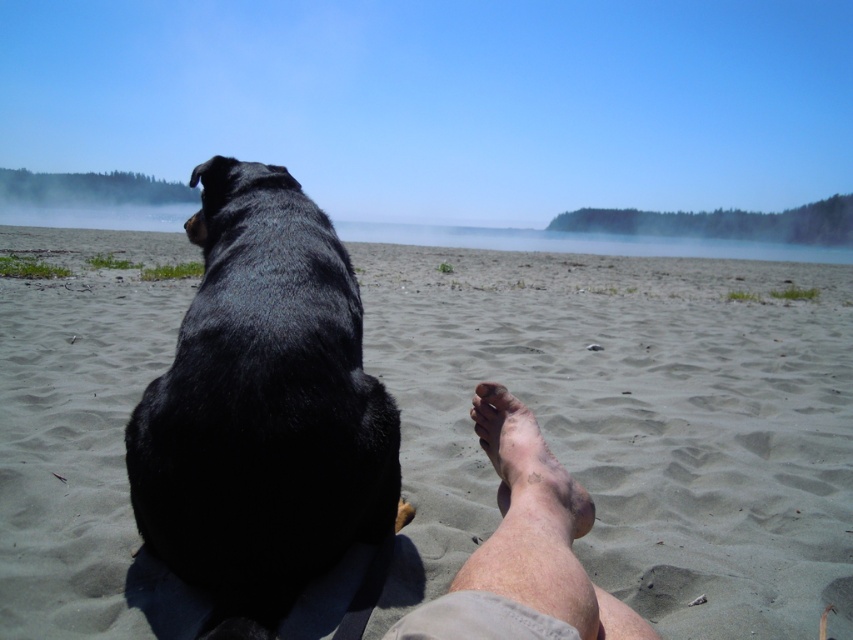
Question: Can you confirm if skinny barefoot leg at lower center is bigger than brown dirt foot at lower center?

Choices:
 (A) yes
 (B) no

Answer: (A)

Question: Based on their relative distances, which object is nearer to the skinny barefoot leg at lower center?

Choices:
 (A) brown dirt foot at lower center
 (B) black fur dog at left

Answer: (A)

Question: Which object is positioned farthest from the skinny barefoot leg at lower center?

Choices:
 (A) brown dirt foot at lower center
 (B) black fur dog at left

Answer: (B)

Question: Which point appears farthest from the camera in this image?

Choices:
 (A) (454, 612)
 (B) (219, 602)

Answer: (B)

Question: From the image, what is the correct spatial relationship of black fur dog at left in relation to skinny barefoot leg at lower center?

Choices:
 (A) left
 (B) right

Answer: (A)

Question: Does sandy at upper center come behind skinny barefoot leg at lower center?

Choices:
 (A) no
 (B) yes

Answer: (B)